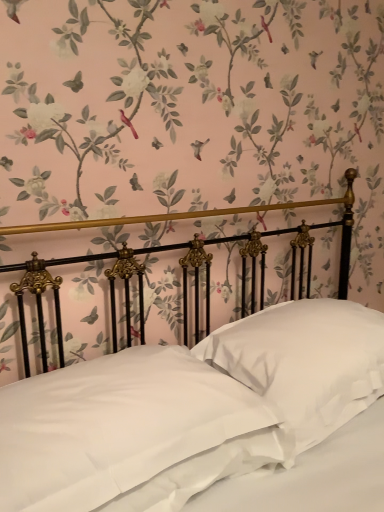
Question: From a real-world perspective, is white satin pillow at center, which ranks as the 2th pillow in right-to-left order, positioned under white satin pillow at center, the second pillow when ordered from left to right, based on gravity?

Choices:
 (A) no
 (B) yes

Answer: (B)

Question: Considering the relative sizes of white satin pillow at center, which appears as the first pillow when viewed from the left, and white satin pillow at center, which is the 1th pillow in right-to-left order, in the image provided, is white satin pillow at center, which appears as the first pillow when viewed from the left, wider than white satin pillow at center, which is the 1th pillow in right-to-left order,?

Choices:
 (A) no
 (B) yes

Answer: (B)

Question: Is white satin pillow at center, which appears as the first pillow when viewed from the left, to the left of white satin pillow at center, which is the 1th pillow in right-to-left order, from the viewer's perspective?

Choices:
 (A) no
 (B) yes

Answer: (B)

Question: From the image's perspective, would you say white satin pillow at center, which appears as the first pillow when viewed from the left, is shown under white satin pillow at center, the second pillow when ordered from left to right?

Choices:
 (A) yes
 (B) no

Answer: (A)

Question: Is white satin pillow at center, which ranks as the 2th pillow in right-to-left order, outside of white satin pillow at center, which is the 1th pillow in right-to-left order?

Choices:
 (A) yes
 (B) no

Answer: (A)

Question: Considering their positions, is satin white bed at center located in front of or behind white satin pillow at center, which appears as the first pillow when viewed from the left?

Choices:
 (A) behind
 (B) front

Answer: (B)

Question: Considering the positions of point (347, 348) and point (79, 397), is point (347, 348) closer or farther from the camera than point (79, 397)?

Choices:
 (A) closer
 (B) farther

Answer: (B)

Question: Would you say satin white bed at center is inside or outside white satin pillow at center, which ranks as the 2th pillow in right-to-left order?

Choices:
 (A) outside
 (B) inside

Answer: (A)

Question: Based on their positions, is satin white bed at center located to the left or right of white satin pillow at center, which appears as the first pillow when viewed from the left?

Choices:
 (A) right
 (B) left

Answer: (A)

Question: Is white satin pillow at center, which appears as the first pillow when viewed from the left, wider or thinner than white satin pillow at center, the second pillow when ordered from left to right?

Choices:
 (A) wide
 (B) thin

Answer: (A)

Question: Is point (129, 421) closer or farther from the camera than point (321, 387)?

Choices:
 (A) farther
 (B) closer

Answer: (B)

Question: Based on their sizes in the image, would you say white satin pillow at center, which ranks as the 2th pillow in right-to-left order, is bigger or smaller than white satin pillow at center, the second pillow when ordered from left to right?

Choices:
 (A) big
 (B) small

Answer: (B)

Question: Relative to white satin pillow at center, the second pillow when ordered from left to right, is white satin pillow at center, which ranks as the 2th pillow in right-to-left order, in front or behind?

Choices:
 (A) behind
 (B) front

Answer: (B)

Question: Considering their positions, is satin white bed at center located in front of or behind white satin pillow at center, the second pillow when ordered from left to right?

Choices:
 (A) behind
 (B) front

Answer: (B)

Question: Is satin white bed at center spatially inside white satin pillow at center, the second pillow when ordered from left to right, or outside of it?

Choices:
 (A) inside
 (B) outside

Answer: (B)